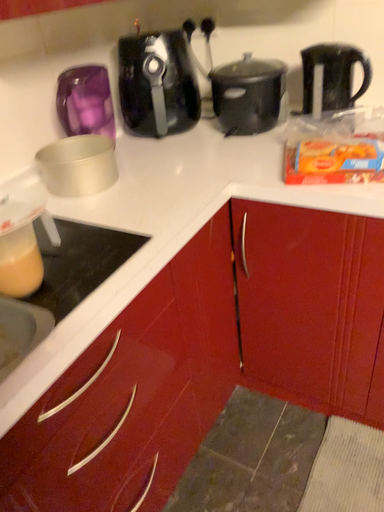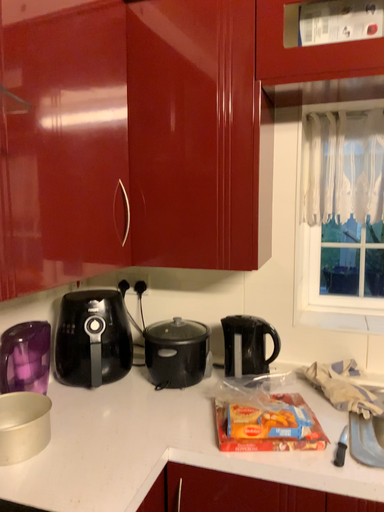
Question: Which way did the camera rotate in the video?

Choices:
 (A) rotated downward
 (B) rotated upward

Answer: (B)